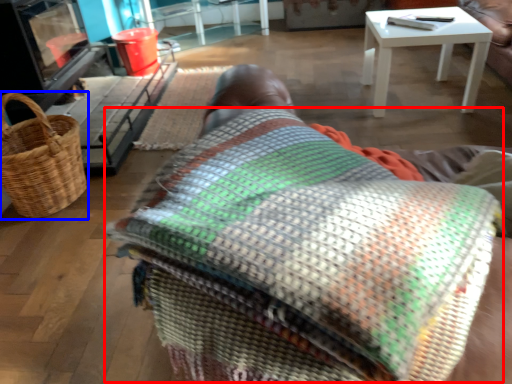
Question: Which object appears closest to the camera in this image, blanket (highlighted by a red box) or picnic basket (highlighted by a blue box)?

Choices:
 (A) blanket
 (B) picnic basket

Answer: (A)